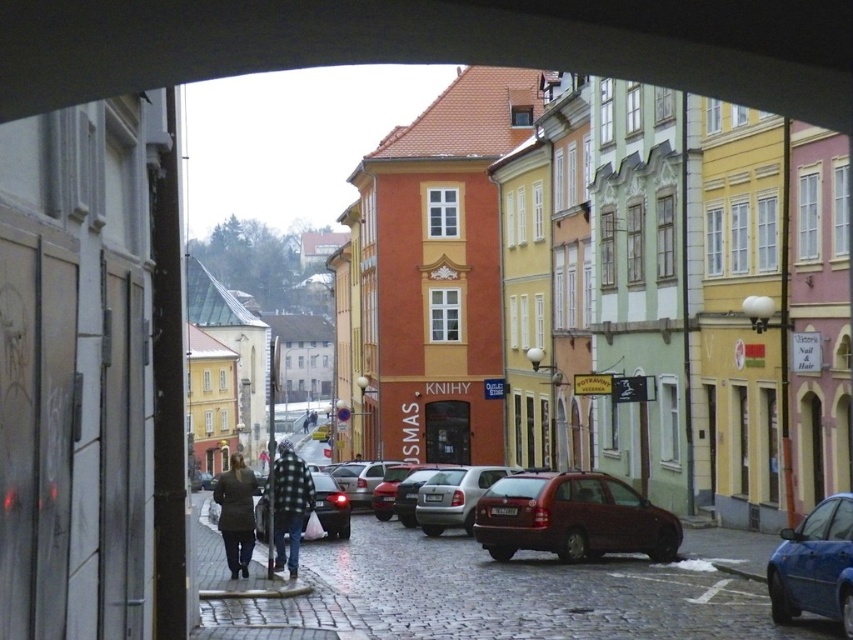
Does shiny red car at center have a greater width compared to blue metallic car at lower right?

Yes, shiny red car at center is wider than blue metallic car at lower right.

Locate an element on the screen. shiny red car at center is located at coordinates (572, 516).

Locate an element on the screen. shiny red car at center is located at coordinates (572, 516).

Does silver metallic car at center appear under matte black car at center?

Incorrect, silver metallic car at center is not positioned below matte black car at center.

Does silver metallic car at center come in front of matte black car at center?

No, it is behind matte black car at center.

Between point (439, 486) and point (260, 497), which one is positioned behind?

Positioned behind is point (439, 486).

I want to click on silver metallic car at center, so click(454, 497).

Based on the photo, between orange matte building at center and silver metallic car at center, which one appears on the left side from the viewer's perspective?

From the viewer's perspective, orange matte building at center appears more on the left side.

Which is in front, point (457, 364) or point (474, 472)?

Point (474, 472) is in front.

Measure the distance between point (398, 308) and camera.

Point (398, 308) and camera are 202.81 feet apart from each other.

Find the location of a particular element. The height and width of the screenshot is (640, 853). orange matte building at center is located at coordinates (553, 288).